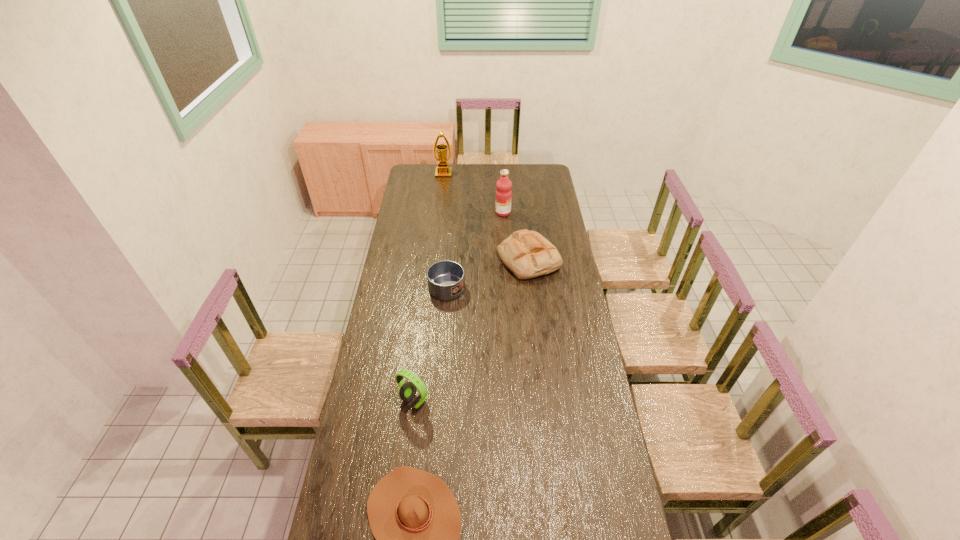
Where is `award`? award is located at coordinates click(443, 171).

Locate an element on the screen. The width and height of the screenshot is (960, 540). the fifth nearest object is located at coordinates (503, 195).

Locate an element on the screen. The width and height of the screenshot is (960, 540). the fifth farthest object is located at coordinates (407, 391).

In order to click on headset in this screenshot , I will do `click(407, 391)`.

Locate an element on the screen. This screenshot has width=960, height=540. bread is located at coordinates (527, 254).

The width and height of the screenshot is (960, 540). I want to click on the fifth tallest object, so click(x=446, y=279).

At what (x,y) coordinates should I click in order to perform the action: click on vacant space located on the front-facing side of the farthest object. Please return your answer as a coordinate pair (x, y). The height and width of the screenshot is (540, 960). Looking at the image, I should click on (440, 213).

You are a GUI agent. You are given a task and a screenshot of the screen. Output one action in this format:
    pyautogui.click(x=<x>, y=<y>)
    Task: Click on the free spot located 0.340m on the label of the fruit juice
    
    Given the screenshot: What is the action you would take?
    pyautogui.click(x=436, y=212)

Locate an element on the screen. Image resolution: width=960 pixels, height=540 pixels. free spot located 0.330m on the label of the fruit juice is located at coordinates (438, 212).

Locate an element on the screen. The image size is (960, 540). vacant area located on the label of the fruit juice is located at coordinates (431, 212).